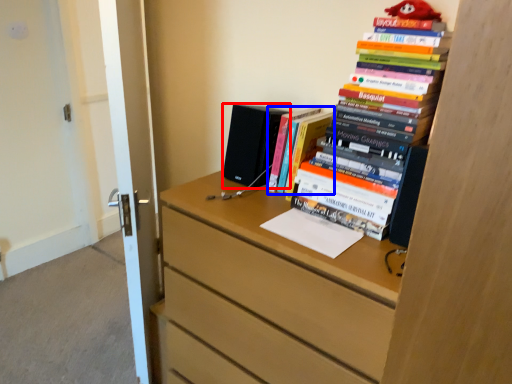
Question: Which of the following is the closest to the observer, speaker (highlighted by a red box) or book (highlighted by a blue box)?

Choices:
 (A) speaker
 (B) book

Answer: (B)